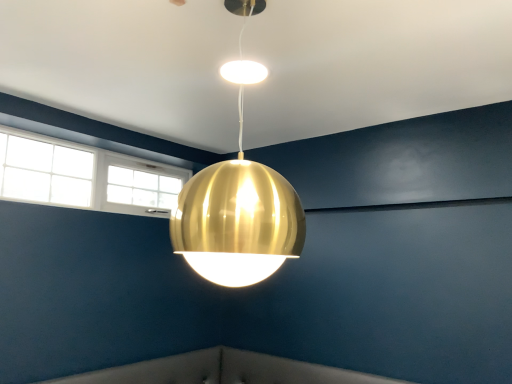
Question: In terms of height, does white glass window at upper left look taller or shorter compared to gold metallic sphere at center?

Choices:
 (A) tall
 (B) short

Answer: (B)

Question: Is point (187, 173) positioned closer to the camera than point (250, 195)?

Choices:
 (A) closer
 (B) farther

Answer: (B)

Question: Based on their positions, is white glass window at upper left located to the left or right of gold metallic sphere at center?

Choices:
 (A) left
 (B) right

Answer: (A)

Question: Is gold metallic sphere at center taller or shorter than white glass window at upper left?

Choices:
 (A) tall
 (B) short

Answer: (A)

Question: Which is correct: gold metallic sphere at center is inside white glass window at upper left, or outside of it?

Choices:
 (A) inside
 (B) outside

Answer: (B)

Question: Visually, is gold metallic sphere at center positioned to the left or to the right of white glass window at upper left?

Choices:
 (A) right
 (B) left

Answer: (A)

Question: From a real-world perspective, is gold metallic sphere at center above or below white glass window at upper left?

Choices:
 (A) above
 (B) below

Answer: (B)